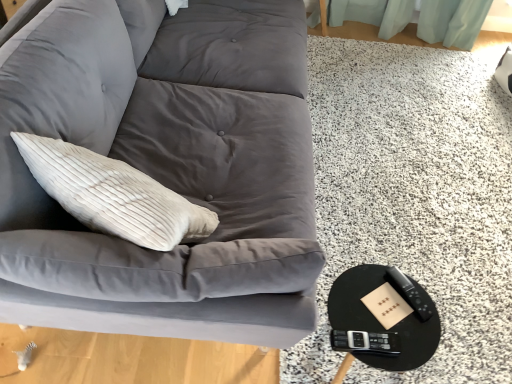
Question: Does matte gray fabric couch at upper left have a lesser height compared to black glossy round table at lower right?

Choices:
 (A) no
 (B) yes

Answer: (A)

Question: Can you confirm if matte gray fabric couch at upper left is taller than black glossy round table at lower right?

Choices:
 (A) yes
 (B) no

Answer: (A)

Question: From a real-world perspective, is matte gray fabric couch at upper left below black glossy round table at lower right?

Choices:
 (A) no
 (B) yes

Answer: (A)

Question: Is matte gray fabric couch at upper left oriented away from black glossy round table at lower right?

Choices:
 (A) yes
 (B) no

Answer: (B)

Question: From the image's perspective, would you say matte gray fabric couch at upper left is shown under black glossy round table at lower right?

Choices:
 (A) yes
 (B) no

Answer: (B)

Question: Can you confirm if matte gray fabric couch at upper left is thinner than black glossy round table at lower right?

Choices:
 (A) yes
 (B) no

Answer: (A)

Question: Are black plastic remote at lower right and matte gray fabric couch at upper left far apart?

Choices:
 (A) yes
 (B) no

Answer: (B)

Question: Can you confirm if black plastic remote at lower right is thinner than matte gray fabric couch at upper left?

Choices:
 (A) no
 (B) yes

Answer: (B)

Question: Is black plastic remote at lower right smaller than matte gray fabric couch at upper left?

Choices:
 (A) no
 (B) yes

Answer: (B)

Question: Can you confirm if black plastic remote at lower right is positioned to the right of matte gray fabric couch at upper left?

Choices:
 (A) yes
 (B) no

Answer: (A)

Question: Considering the relative sizes of black plastic remote at lower right and matte gray fabric couch at upper left in the image provided, is black plastic remote at lower right taller than matte gray fabric couch at upper left?

Choices:
 (A) yes
 (B) no

Answer: (B)

Question: From a real-world perspective, is black plastic remote at lower right over matte gray fabric couch at upper left?

Choices:
 (A) no
 (B) yes

Answer: (A)

Question: Is black glossy round table at lower right taller than matte gray fabric couch at upper left?

Choices:
 (A) yes
 (B) no

Answer: (B)